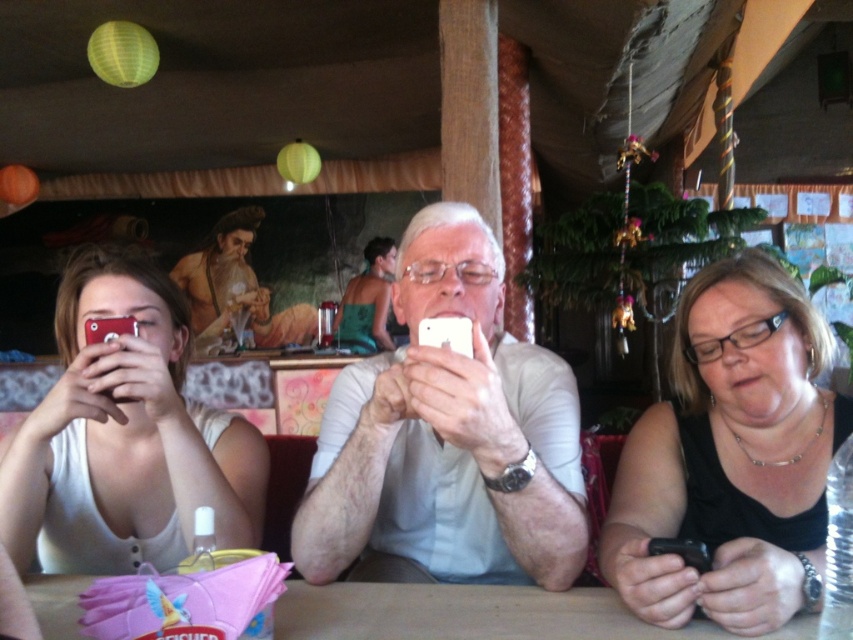
Who is positioned more to the right, white matte phone at center or black matte phone at center right?

black matte phone at center right

Does white matte phone at center appear over black matte phone at center right?

Yes.

Between point (426, 408) and point (824, 540), which one is positioned in front?

Positioned in front is point (426, 408).

I want to click on white matte phone at center, so click(x=410, y=392).

Can you confirm if white matte shirt at center is taller than white matte phone at center?

Incorrect, white matte shirt at center's height is not larger of white matte phone at center's.

Image resolution: width=853 pixels, height=640 pixels. What are the coordinates of `white matte shirt at center` in the screenshot? It's located at (450, 435).

Is point (314, 531) in front of point (405, 312)?

Yes, point (314, 531) is in front of point (405, 312).

Locate an element on the screen. This screenshot has height=640, width=853. white matte shirt at center is located at coordinates (450, 435).

At what (x,y) coordinates should I click in order to perform the action: click on black matte phone at center right. Please return your answer as a coordinate pair (x, y). Looking at the image, I should click on coord(730,458).

Between black matte phone at center right and green fabric bikini top at center, which one is positioned higher?

green fabric bikini top at center

At what (x,y) coordinates should I click in order to perform the action: click on black matte phone at center right. Please return your answer as a coordinate pair (x, y). Image resolution: width=853 pixels, height=640 pixels. Looking at the image, I should click on (730, 458).

Where is `black matte phone at center right`? The width and height of the screenshot is (853, 640). black matte phone at center right is located at coordinates coord(730,458).